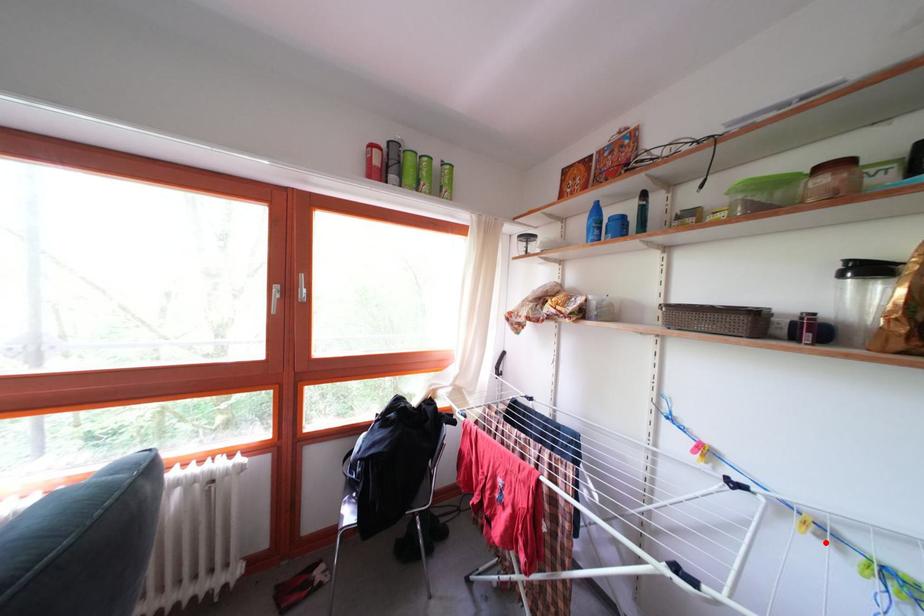
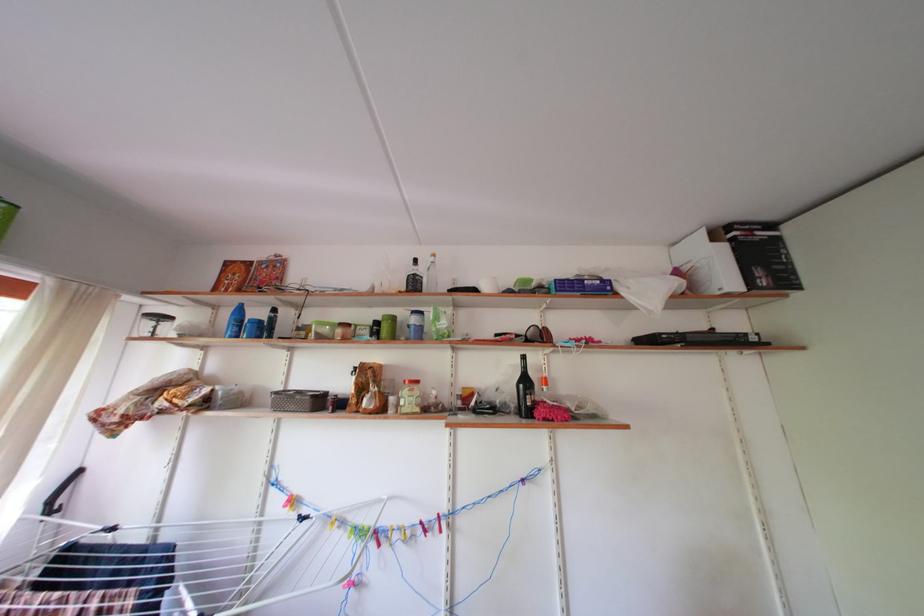
Question: I am providing you with two images of the same scene from different viewpoints. Image1 has a red point marked. In image2, the corresponding 3D location appears at what relative position? Reply with the corresponding letter.

Choices:
 (A) Closer
 (B) Farther

Answer: (B)